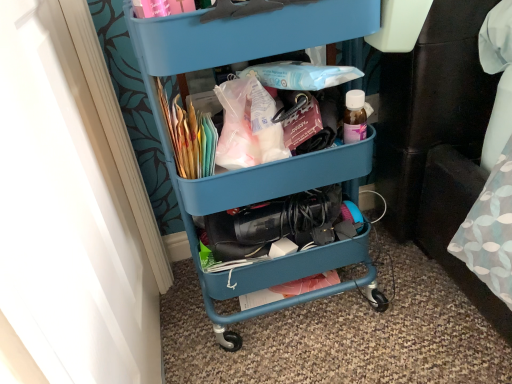
What is the approximate width of blue plastic cart at center?

The width of blue plastic cart at center is 15.11 inches.

Image resolution: width=512 pixels, height=384 pixels. What do you see at coordinates (264, 164) in the screenshot? I see `blue plastic cart at center` at bounding box center [264, 164].

The height and width of the screenshot is (384, 512). I want to click on blue plastic cart at center, so click(264, 164).

What is the approximate height of blue plastic cart at center?

The height of blue plastic cart at center is 30.12 inches.

I want to click on blue plastic cart at center, so click(x=264, y=164).